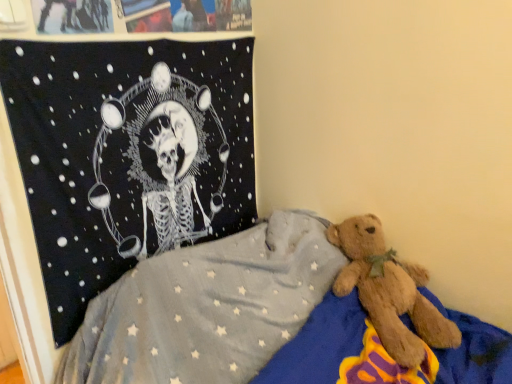
Question: Based on their sizes in the image, would you say black fabric tapestry at upper left is bigger or smaller than soft blue blanket with star pattern at center?

Choices:
 (A) big
 (B) small

Answer: (B)

Question: Relative to soft blue blanket with star pattern at center, is black fabric tapestry at upper left in front or behind?

Choices:
 (A) front
 (B) behind

Answer: (B)

Question: From a real-world perspective, is black fabric tapestry at upper left above or below soft blue blanket with star pattern at center?

Choices:
 (A) below
 (B) above

Answer: (B)

Question: From a real-world perspective, is soft blue blanket with star pattern at center above or below black fabric tapestry at upper left?

Choices:
 (A) above
 (B) below

Answer: (B)

Question: Considering the positions of soft blue blanket with star pattern at center and black fabric tapestry at upper left in the image, is soft blue blanket with star pattern at center taller or shorter than black fabric tapestry at upper left?

Choices:
 (A) short
 (B) tall

Answer: (A)

Question: Is point (265, 372) positioned closer to the camera than point (187, 145)?

Choices:
 (A) farther
 (B) closer

Answer: (B)

Question: From the image's perspective, is soft blue blanket with star pattern at center above or below black fabric tapestry at upper left?

Choices:
 (A) below
 (B) above

Answer: (A)